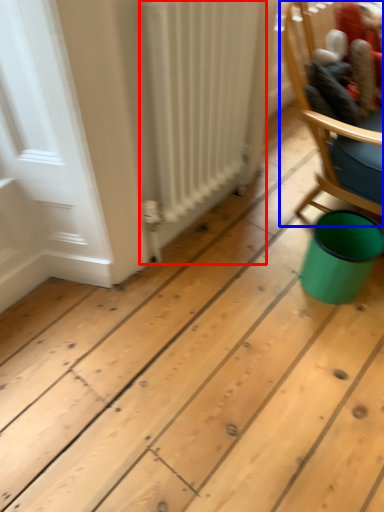
Question: Which of the following is the farthest to the observer, radiator (highlighted by a red box) or chair (highlighted by a blue box)?

Choices:
 (A) radiator
 (B) chair

Answer: (B)